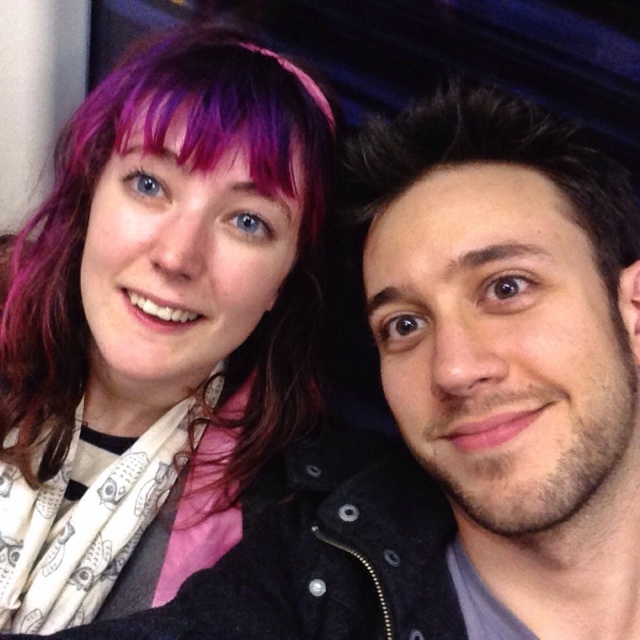
From the picture: You are trying to decide which black jacket to purchase between the matte black jacket at upper left and the smooth black jacket at right. The store only allows you to choose based on size. Which one should you pick if you prefer a larger size?

The matte black jacket at upper left has a larger size compared to the smooth black jacket at right, so you should choose the matte black jacket at upper left if you prefer a larger size.

Based on the photo, you are trying to decide which jacket to wear for an evening event. You see both the matte black jacket at upper left and the smooth black jacket at right in the image. Which one is taller?

The matte black jacket at upper left has a greater height compared to the smooth black jacket at right, so the matte black jacket at upper left is taller.